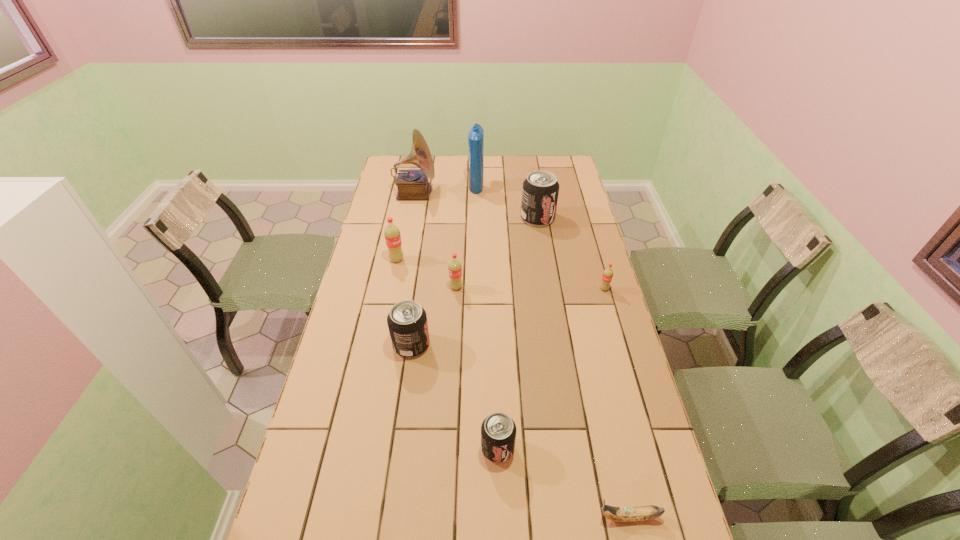
Image resolution: width=960 pixels, height=540 pixels. Find the location of `shampoo`. shampoo is located at coordinates 475,137.

I want to click on brown phonograph record, so click(412, 184).

You are a GUI agent. You are given a task and a screenshot of the screen. Output one action in this format:
    pyautogui.click(x=<x>, y=<y>)
    Task: Click on the biggest black soda can
    The image size is (960, 540).
    Given the screenshot: What is the action you would take?
    pyautogui.click(x=540, y=191)

The height and width of the screenshot is (540, 960). Find the location of `the farthest soda can`. the farthest soda can is located at coordinates (540, 191).

The height and width of the screenshot is (540, 960). Identify the location of the leftmost soda can. (392, 235).

At what (x,y) coordinates should I click in order to perform the action: click on the biggest red soda. Please return your answer as a coordinate pair (x, y). The width and height of the screenshot is (960, 540). Looking at the image, I should click on (392, 235).

Where is `the second red soda from right to left`? the second red soda from right to left is located at coordinates (455, 268).

Identify the location of the third soda can from left to right. The image size is (960, 540). (455, 268).

You are a GUI agent. You are given a task and a screenshot of the screen. Output one action in this format:
    pyautogui.click(x=<x>, y=<y>)
    Task: Click on the fifth farthest soda can
    
    Given the screenshot: What is the action you would take?
    pyautogui.click(x=407, y=321)

You are a GUI agent. You are given a task and a screenshot of the screen. Output one action in this format:
    pyautogui.click(x=<x>, y=<y>)
    Task: Click on the seventh farthest object
    This screenshot has width=960, height=540.
    Given the screenshot: What is the action you would take?
    pyautogui.click(x=407, y=321)